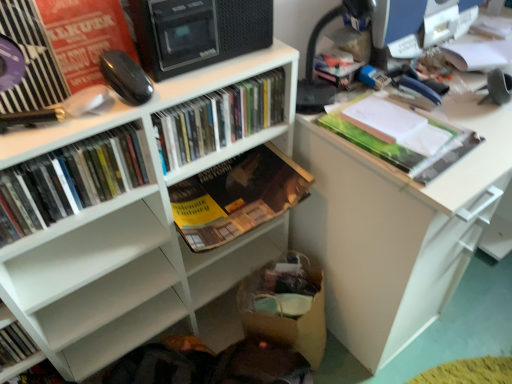
Question: Is hardcover book at lower left, positioned as the first book in left-to-right order, bigger than green matte folder at upper right, the 1th book positioned from the right?

Choices:
 (A) no
 (B) yes

Answer: (B)

Question: From the image's perspective, is hardcover book at lower left, positioned as the first book in left-to-right order, under green matte folder at upper right, the 1th book positioned from the right?

Choices:
 (A) no
 (B) yes

Answer: (B)

Question: Does hardcover book at lower left, the 5th book viewed from the right, have a smaller size compared to green matte folder at upper right, the 1th book positioned from the right?

Choices:
 (A) yes
 (B) no

Answer: (B)

Question: Does hardcover book at lower left, positioned as the first book in left-to-right order, contain green matte folder at upper right, the 1th book positioned from the right?

Choices:
 (A) no
 (B) yes

Answer: (A)

Question: Considering the relative sizes of hardcover book at lower left, the 5th book viewed from the right, and green matte folder at upper right, the 5th book viewed from the left, in the image provided, is hardcover book at lower left, the 5th book viewed from the right, taller than green matte folder at upper right, the 5th book viewed from the left,?

Choices:
 (A) no
 (B) yes

Answer: (B)

Question: Does hardcover book at lower left, positioned as the first book in left-to-right order, have a greater width compared to green matte folder at upper right, the 5th book viewed from the left?

Choices:
 (A) yes
 (B) no

Answer: (B)

Question: Considering the relative sizes of matte black monitor at upper right and matte plastic books at center, placed as the third book when sorted from left to right, in the image provided, is matte black monitor at upper right taller than matte plastic books at center, placed as the third book when sorted from left to right,?

Choices:
 (A) yes
 (B) no

Answer: (A)

Question: Considering the relative positions of matte black monitor at upper right and matte plastic books at center, placed as the third book when sorted from left to right, in the image provided, is matte black monitor at upper right behind matte plastic books at center, placed as the third book when sorted from left to right,?

Choices:
 (A) yes
 (B) no

Answer: (A)

Question: From a real-world perspective, is matte black monitor at upper right physically below matte plastic books at center, which is counted as the 3th book, starting from the right?

Choices:
 (A) no
 (B) yes

Answer: (A)

Question: Would you say matte black monitor at upper right is outside matte plastic books at center, which is counted as the 3th book, starting from the right?

Choices:
 (A) no
 (B) yes

Answer: (B)

Question: Is there a large distance between matte black monitor at upper right and matte plastic books at center, placed as the third book when sorted from left to right?

Choices:
 (A) yes
 (B) no

Answer: (B)

Question: From a real-world perspective, is matte black monitor at upper right positioned over matte plastic books at center, placed as the third book when sorted from left to right, based on gravity?

Choices:
 (A) no
 (B) yes

Answer: (B)

Question: Is the depth of white matte bookcase at upper left less than that of matte plastic books at center, which is counted as the 3th book, starting from the right?

Choices:
 (A) no
 (B) yes

Answer: (B)